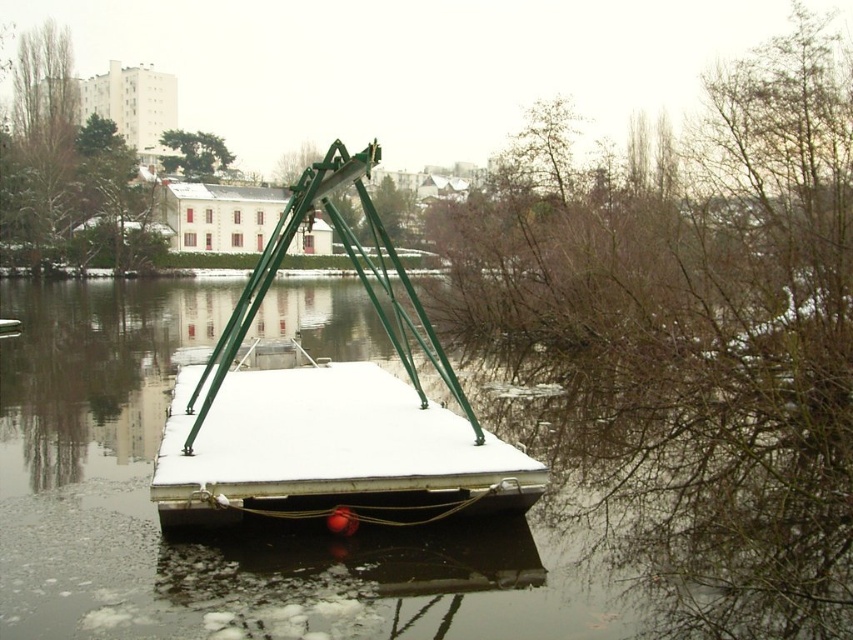
Question: Does white snow-covered dock at center appear on the right side of green metallic boat at center?

Choices:
 (A) no
 (B) yes

Answer: (A)

Question: Is white snow-covered dock at center to the left of green metallic boat at center from the viewer's perspective?

Choices:
 (A) no
 (B) yes

Answer: (B)

Question: Which point is farther to the camera?

Choices:
 (A) (57, 282)
 (B) (369, 467)

Answer: (A)

Question: Among these objects, which one is nearest to the camera?

Choices:
 (A) green metallic boat at center
 (B) white snow-covered dock at center

Answer: (B)

Question: Can you confirm if white snow-covered dock at center is bigger than green metallic boat at center?

Choices:
 (A) yes
 (B) no

Answer: (A)